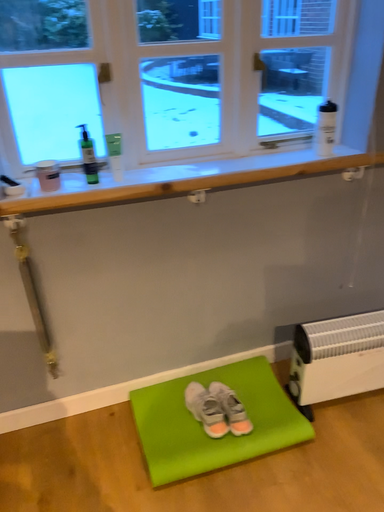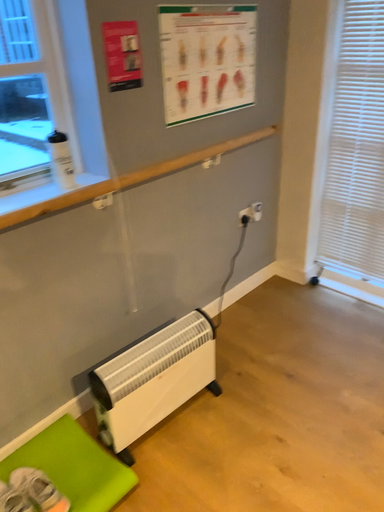
Question: Which way did the camera rotate in the video?

Choices:
 (A) rotated downward
 (B) rotated upward

Answer: (B)